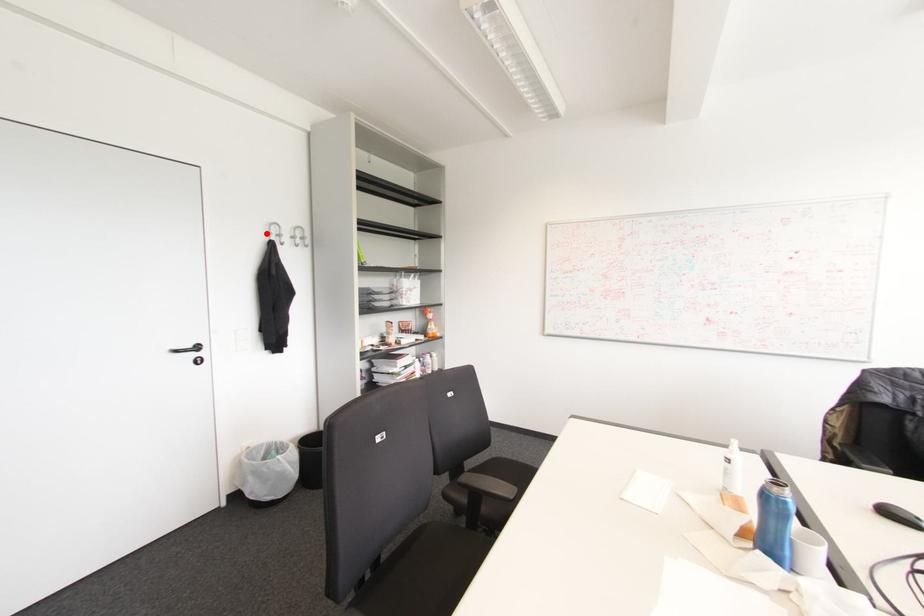
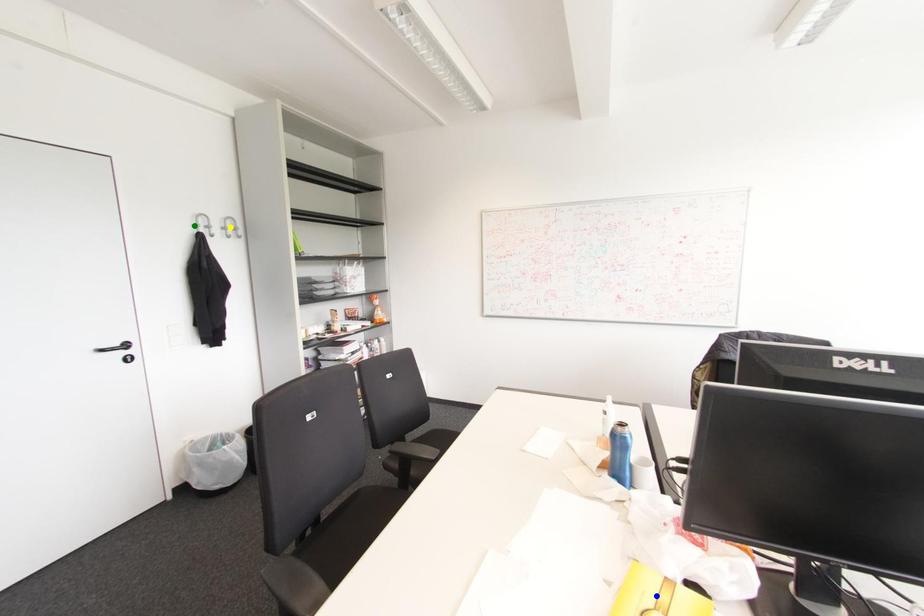
Question: I am providing you with two images of the same scene from different viewpoints. A red point is marked on the first image. You are given multiple points on the second image. Which spot in image 2 lines up with the point in image 1?

Choices:
 (A) blue point
 (B) yellow point
 (C) green point

Answer: (C)